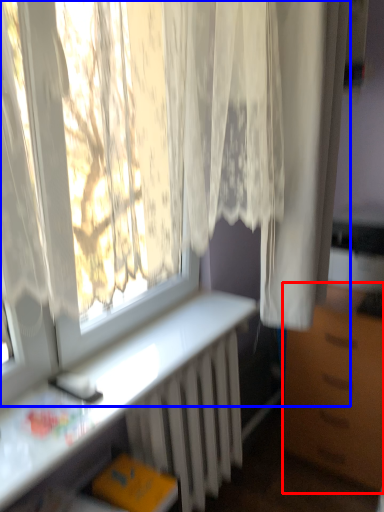
Question: Which of the following is the closest to the observer, furniture (highlighted by a red box) or curtain (highlighted by a blue box)?

Choices:
 (A) furniture
 (B) curtain

Answer: (B)